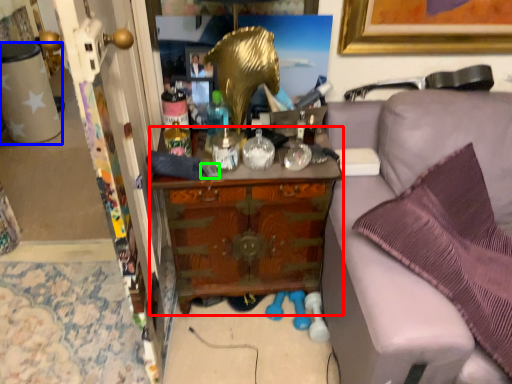
Question: Which object is the farthest from cabinetry (highlighted by a red box)? Choose among these: desk (highlighted by a blue box) or remote control (highlighted by a green box).

Choices:
 (A) desk
 (B) remote control

Answer: (A)